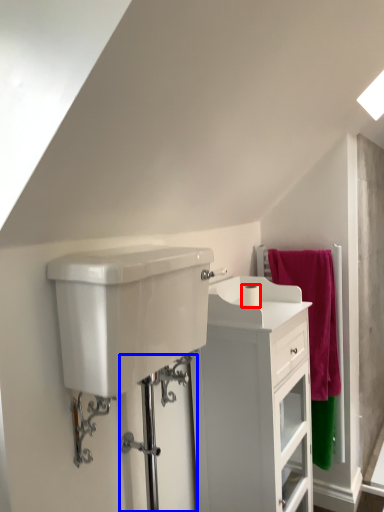
Question: Which of the following is the farthest to the observer, toilet paper (highlighted by a red box) or shower door (highlighted by a blue box)?

Choices:
 (A) toilet paper
 (B) shower door

Answer: (A)